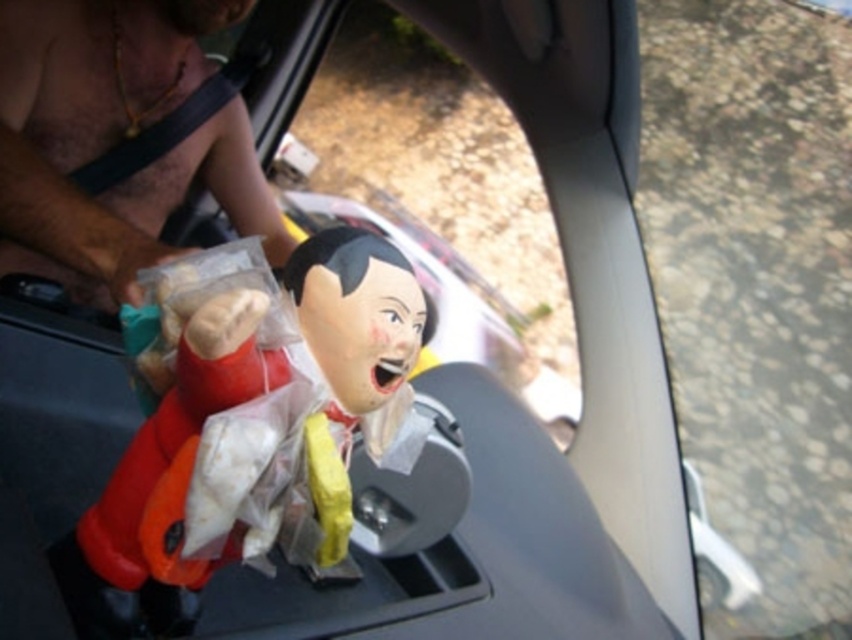
You are a passenger in a car and notice two dolls on the dashboard. The matte plastic doll at center and the transparent plastic doll at center. Which one is shorter?

The matte plastic doll at center is shorter than the transparent plastic doll at center.

You are a passenger in a car and notice two dolls on the dashboard. The matte plastic doll at center and the transparent plastic doll at center. Which one is sitting directly on top of the other?

The matte plastic doll at center is positioned under the transparent plastic doll at center, so the transparent plastic doll at center is sitting directly on top of the matte plastic doll at center.

You are standing 5 meters away from the car. Can you see the point at point (x=459, y=172) in the car? Please explain why.

A: The point at point (x=459, y=172) is 6.06 meters away from the viewer. Since you are only 5 meters away from the car, you are closer than the distance to the point, so you should be able to see it if there are no obstructions.